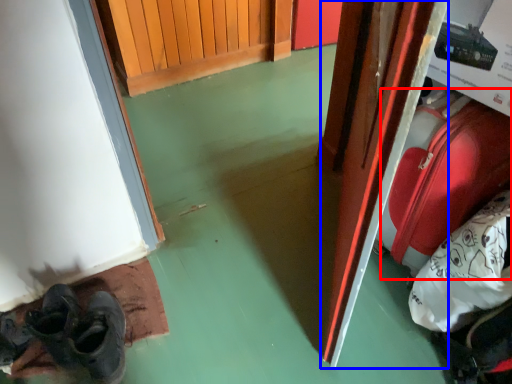
Question: Which object appears farthest to the camera in this image, luggage (highlighted by a red box) or door (highlighted by a blue box)?

Choices:
 (A) luggage
 (B) door

Answer: (A)